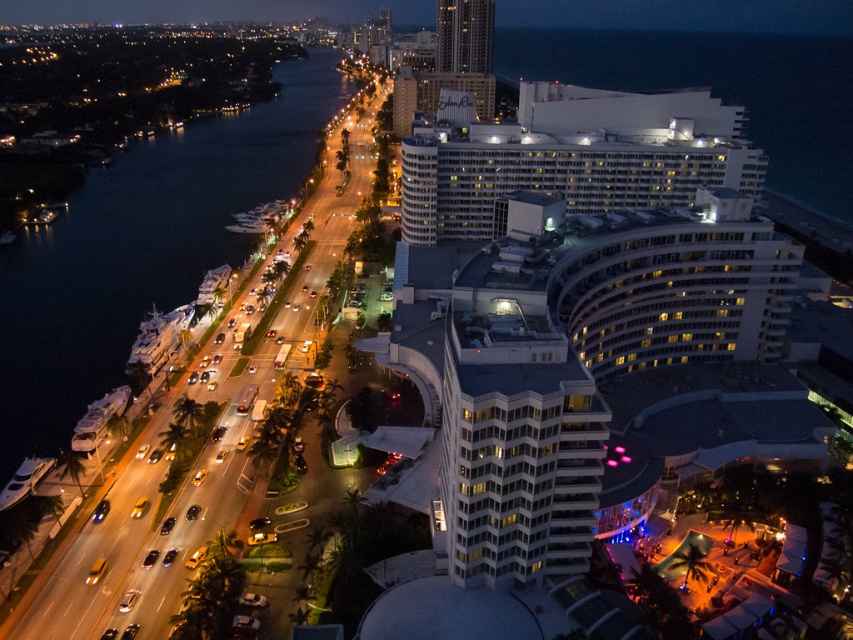
Who is shorter, dark blue water at left or white glass building at upper center?

white glass building at upper center

This screenshot has height=640, width=853. What do you see at coordinates (141, 250) in the screenshot?
I see `dark blue water at left` at bounding box center [141, 250].

Between point (260, 129) and point (450, 16), which one is positioned behind?

Point (260, 129)

This screenshot has width=853, height=640. I want to click on dark blue water at left, so click(x=141, y=250).

Between white glossy building at center and white glass building at upper center, which one appears on the left side from the viewer's perspective?

From the viewer's perspective, white glossy building at center appears more on the left side.

Between point (541, 516) and point (479, 60), which one is positioned behind?

The point (479, 60) is behind.

Identify the location of white glossy building at center. pos(515,449).

Measure the distance between dark blue water at left and white glossy building at center.

113.66 meters

Does point (9, 321) come in front of point (451, 467)?

No, (9, 321) is behind (451, 467).

The image size is (853, 640). Find the location of `dark blue water at left`. dark blue water at left is located at coordinates pos(141,250).